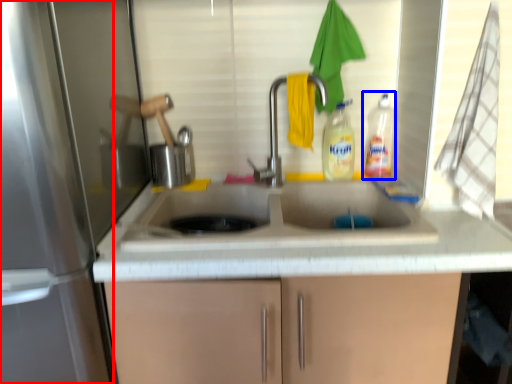
Question: Which of the following is the farthest to the observer, screen door (highlighted by a red box) or bottle (highlighted by a blue box)?

Choices:
 (A) screen door
 (B) bottle

Answer: (B)